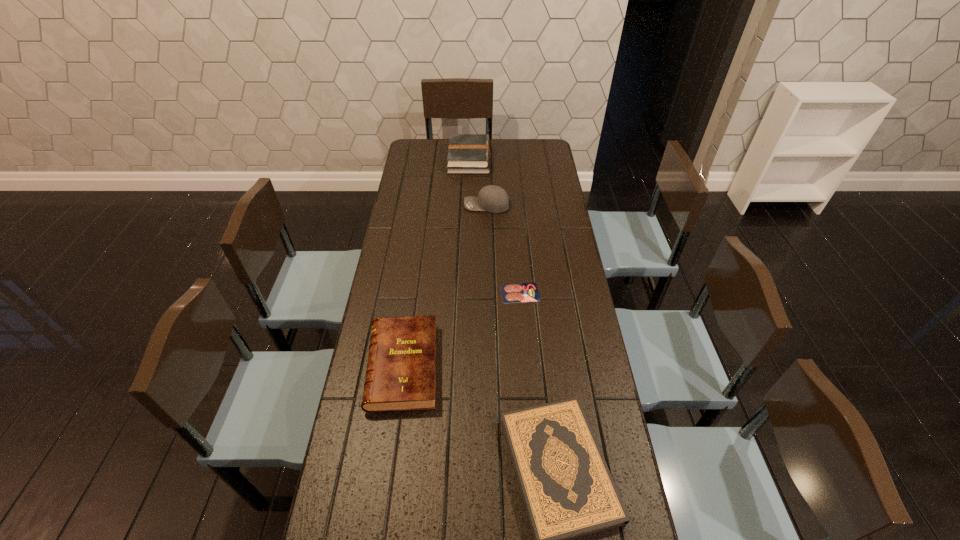
The width and height of the screenshot is (960, 540). What are the coordinates of `blank area in the image that satisfies the following two spatial constraints: 1. on the front brim of the baseball cap; 2. on the back side of the salami` in the screenshot? It's located at (489, 293).

Image resolution: width=960 pixels, height=540 pixels. What are the coordinates of `free spot that satisfies the following two spatial constraints: 1. on the back side of the third nearest object; 2. on the right side of the third shortest object` in the screenshot? It's located at (413, 293).

This screenshot has height=540, width=960. I want to click on free spot that satisfies the following two spatial constraints: 1. on the back side of the third nearest object; 2. on the front brim of the tallest object, so click(513, 205).